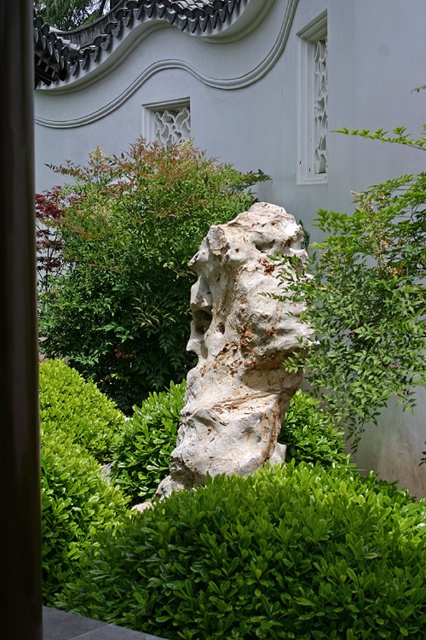
Which is below, white stone sculpture at center or white rough stone at center?

white stone sculpture at center is lower down.

Does white stone sculpture at center have a greater width compared to white rough stone at center?

Correct, the width of white stone sculpture at center exceeds that of white rough stone at center.

Which is in front, point (247, 228) or point (213, 356)?

Positioned in front is point (213, 356).

Image resolution: width=426 pixels, height=640 pixels. I want to click on white stone sculpture at center, so click(238, 349).

Is green leafy hedge at center bigger than white rough stone at center?

Indeed, green leafy hedge at center has a larger size compared to white rough stone at center.

Locate an element on the screen. green leafy hedge at center is located at coordinates (129, 260).

Image resolution: width=426 pixels, height=640 pixels. Identify the location of green leafy hedge at center. (129, 260).

Which of these two, green leafy hedge at center or smooth brown pole at left, stands taller?

With more height is green leafy hedge at center.

Which is more to the left, green leafy hedge at center or smooth brown pole at left?

green leafy hedge at center is more to the left.

What do you see at coordinates (129, 260) in the screenshot? I see `green leafy hedge at center` at bounding box center [129, 260].

At what (x,y) coordinates should I click in order to perform the action: click on green leafy hedge at center. Please return your answer as a coordinate pair (x, y). The image size is (426, 640). Looking at the image, I should click on (129, 260).